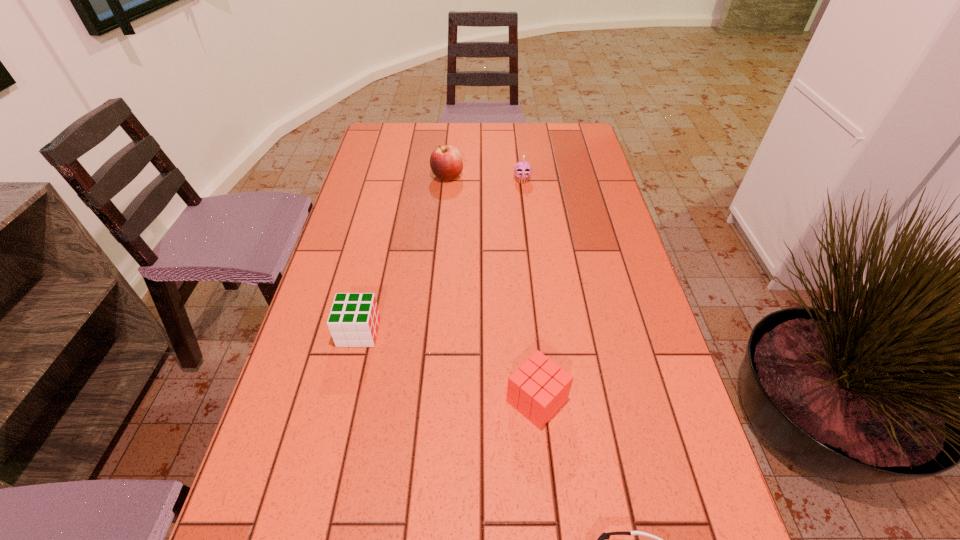
In order to click on blank space located 0.120m on the red face of the leftmost object in this screenshot , I will do `click(430, 332)`.

What are the coordinates of `object located in the left edge section of the desktop` in the screenshot? It's located at (353, 321).

Locate an element on the screen. The width and height of the screenshot is (960, 540). free location at the far edge of the desktop is located at coordinates (521, 154).

Where is `vacant region at the left edge of the desktop`? The image size is (960, 540). vacant region at the left edge of the desktop is located at coordinates [x=346, y=448].

This screenshot has width=960, height=540. What are the coordinates of `vacant space at the right edge` in the screenshot? It's located at (588, 278).

You are a GUI agent. You are given a task and a screenshot of the screen. Output one action in this format:
    pyautogui.click(x=<x>, y=<y>)
    Task: Click on the vacant space at the far left corner
    This screenshot has height=540, width=960.
    Given the screenshot: What is the action you would take?
    pyautogui.click(x=396, y=123)

I want to click on free spot at the far right corner of the desktop, so click(566, 138).

I want to click on free space between the cupcake and the tallest object, so click(485, 179).

What are the coordinates of `vacant point located between the third nearest object and the cupcake` in the screenshot? It's located at (441, 256).

This screenshot has height=540, width=960. Identify the location of vacant area between the leftmost object and the fourth farthest object. (448, 366).